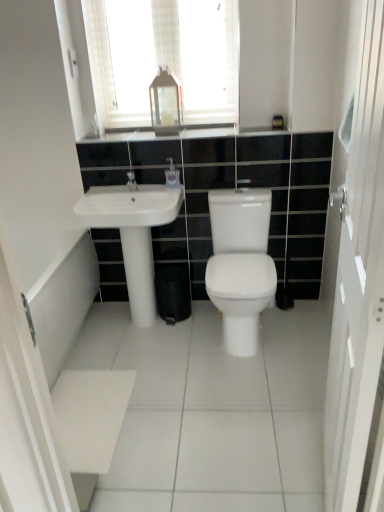
In order to click on free point below white glossy pedestal at center (from a real-world perspective) in this screenshot , I will do `click(135, 324)`.